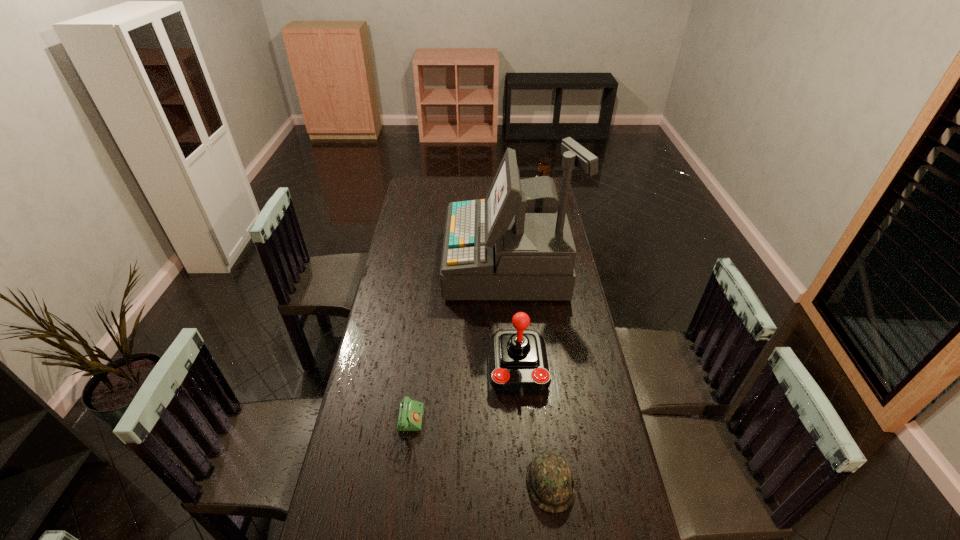
You are a GUI agent. You are given a task and a screenshot of the screen. Output one action in this format:
    pyautogui.click(x=<x>, y=<y>)
    Task: Click on the free space located 0.400m on the side of the farthest object, there is a wick adjustment knob
    This screenshot has width=960, height=540.
    Given the screenshot: What is the action you would take?
    pyautogui.click(x=454, y=197)

Identify the location of free space located on the side of the farthest object, there is a wick adjustment knob. The width and height of the screenshot is (960, 540). (464, 197).

Image resolution: width=960 pixels, height=540 pixels. What are the coordinates of `vacant space located 0.090m on the side of the farthest object, there is a wick adjustment knob` in the screenshot? It's located at (513, 197).

In order to click on vacant region located on the base of the joystick in this screenshot , I will do `click(526, 468)`.

You are a GUI agent. You are given a task and a screenshot of the screen. Output one action in this format:
    pyautogui.click(x=<x>, y=<y>)
    Task: Click on the vacant region located 0.330m on the back of the second shortest object
    The height and width of the screenshot is (540, 960).
    Given the screenshot: What is the action you would take?
    pyautogui.click(x=536, y=362)

In order to click on free space located 0.390m on the dial of the telephone in this screenshot , I will do `click(553, 433)`.

You are a GUI agent. You are given a task and a screenshot of the screen. Output one action in this format:
    pyautogui.click(x=<x>, y=<y>)
    Task: Click on the object that is positioned at the far edge
    
    Given the screenshot: What is the action you would take?
    pyautogui.click(x=543, y=167)

Identify the location of object present at the left edge. (410, 414).

Find the location of `cash register that is at the right edge`. cash register that is at the right edge is located at coordinates (516, 244).

Where is `lantern that is at the right edge`? lantern that is at the right edge is located at coordinates (543, 167).